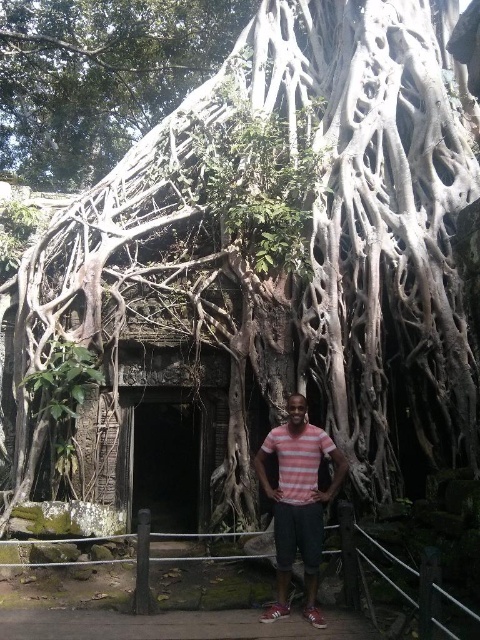
Question: Which point appears closest to the camera in this image?

Choices:
 (A) tap(160, 76)
 (B) tap(191, 394)
 (C) tap(305, 541)

Answer: (C)

Question: Based on their relative distances, which object is nearer to the dark stone doorway at center?

Choices:
 (A) pink striped shirt at center
 (B) green rough bark tree at upper center

Answer: (A)

Question: Is green rough bark tree at upper center to the right of dark stone doorway at center from the viewer's perspective?

Choices:
 (A) yes
 (B) no

Answer: (B)

Question: Does green rough bark tree at upper center come in front of pink striped shirt at center?

Choices:
 (A) no
 (B) yes

Answer: (A)

Question: Does dark stone doorway at center appear on the left side of pink striped shirt at center?

Choices:
 (A) yes
 (B) no

Answer: (A)

Question: Which object is farther from the camera taking this photo?

Choices:
 (A) green rough bark tree at upper center
 (B) pink striped shirt at center

Answer: (A)